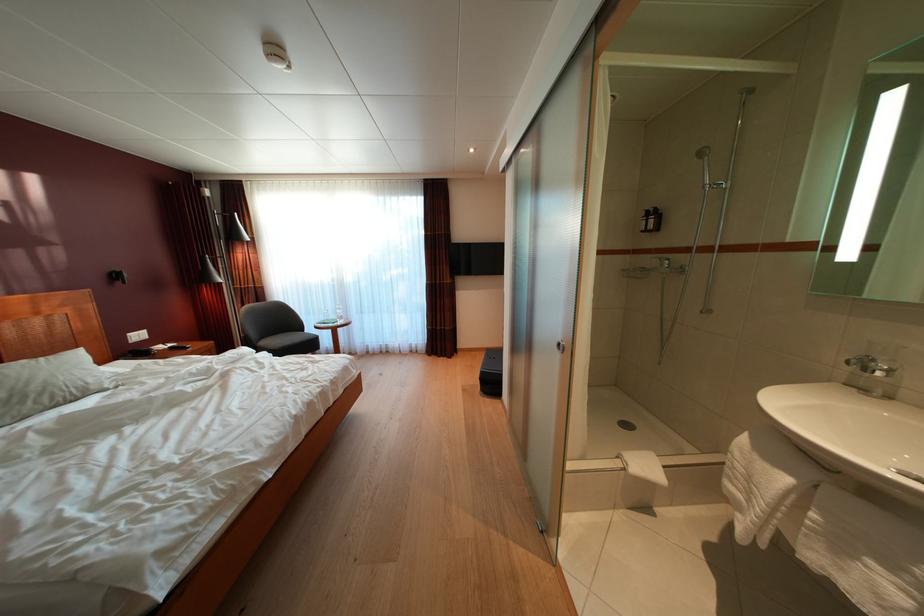
Find where to sit the chair sitting surface. Please return your answer as a coordinate pair (x, y).

(288, 342)